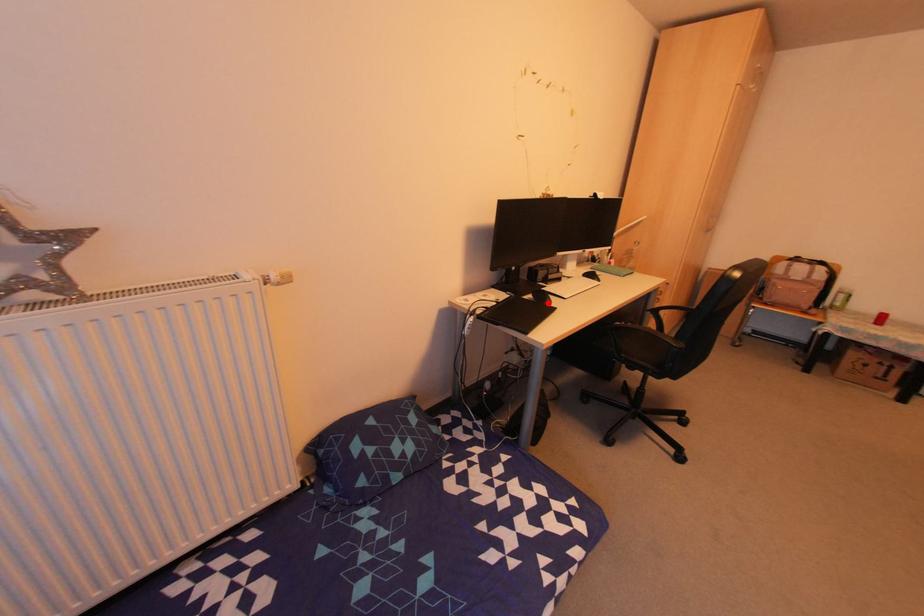
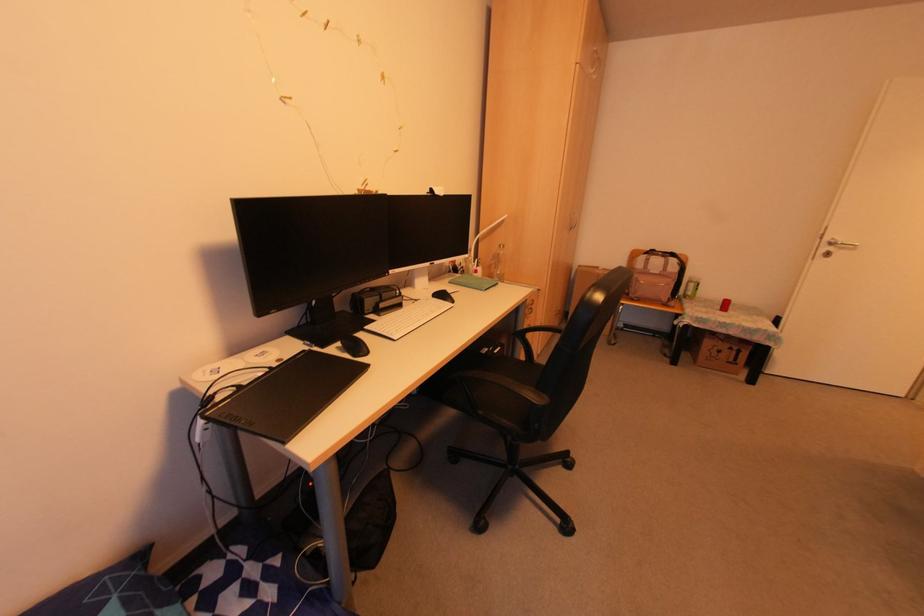
Find the pixel in the second image that matches the highlighted location in the first image.

(365, 353)